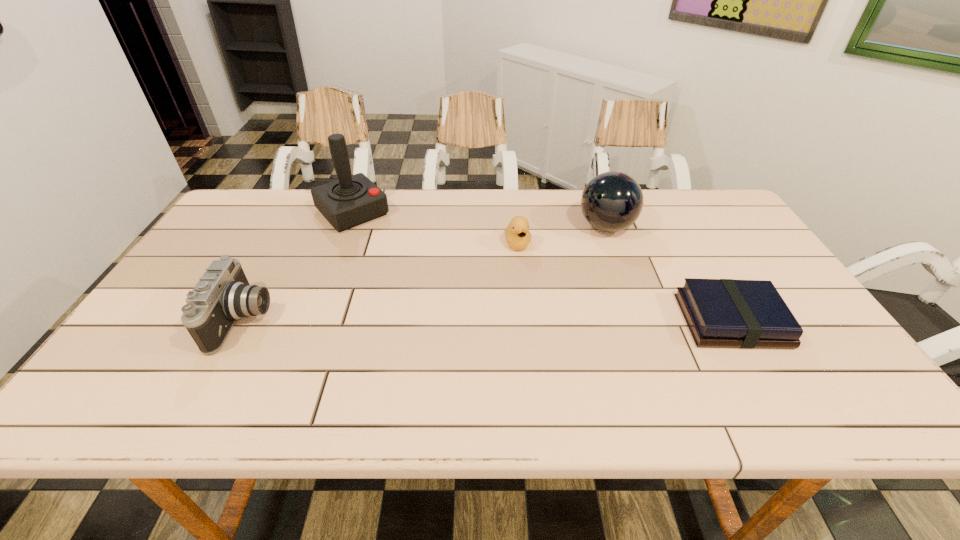
Identify the location of joystick situated at the far edge. click(x=352, y=200).

Image resolution: width=960 pixels, height=540 pixels. What are the coordinates of `camera at the near edge` in the screenshot? It's located at (223, 295).

Find the location of a particular element. The image size is (960, 540). book located in the near edge section of the desktop is located at coordinates (728, 313).

Find the location of `object at the right edge`. object at the right edge is located at coordinates (728, 313).

Image resolution: width=960 pixels, height=540 pixels. I want to click on object located in the near right corner section of the desktop, so click(728, 313).

Find the location of a particular element. This screenshot has height=540, width=960. free region at the far edge of the desktop is located at coordinates (576, 208).

In the image, there is a desktop. Where is `vacant space at the near edge`? The width and height of the screenshot is (960, 540). vacant space at the near edge is located at coordinates (414, 362).

Image resolution: width=960 pixels, height=540 pixels. Identify the location of vacant space at the left edge of the desktop. (188, 336).

In the image, there is a desktop. Where is `free space at the far left corner`? This screenshot has height=540, width=960. free space at the far left corner is located at coordinates (248, 190).

Identify the location of free area in between the tallest object and the camera. (299, 266).